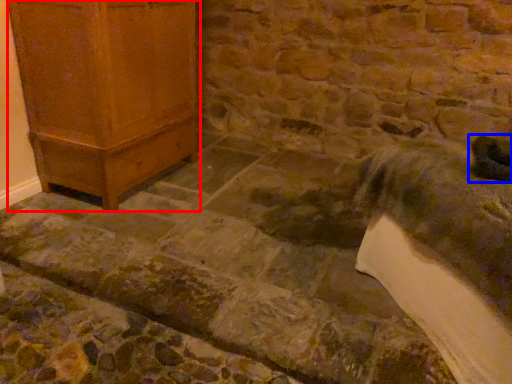
Question: Which object appears farthest to the camera in this image, furniture (highlighted by a red box) or animal (highlighted by a blue box)?

Choices:
 (A) furniture
 (B) animal

Answer: (A)